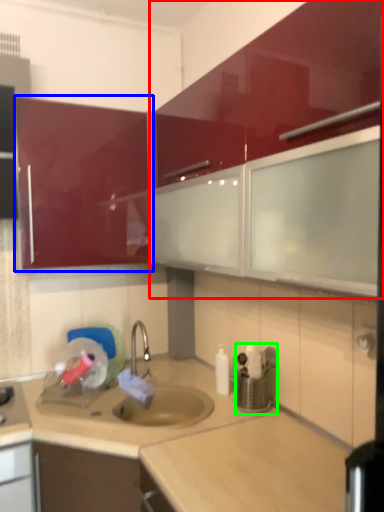
Question: Which object is the farthest from cabinetry (highlighted by a red box)? Choose among these: cabinetry (highlighted by a blue box) or appliance (highlighted by a green box).

Choices:
 (A) cabinetry
 (B) appliance

Answer: (B)